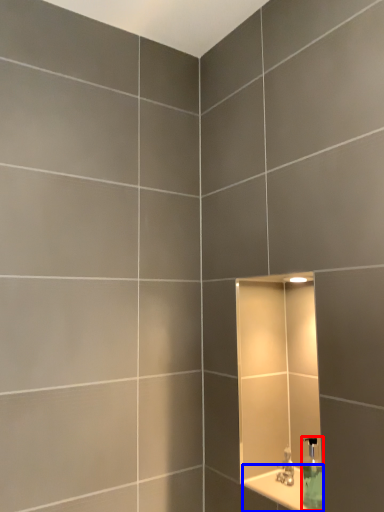
Question: Which object is closer to the camera taking this photo, soap dispenser (highlighted by a red box) or ledge (highlighted by a blue box)?

Choices:
 (A) soap dispenser
 (B) ledge

Answer: (B)